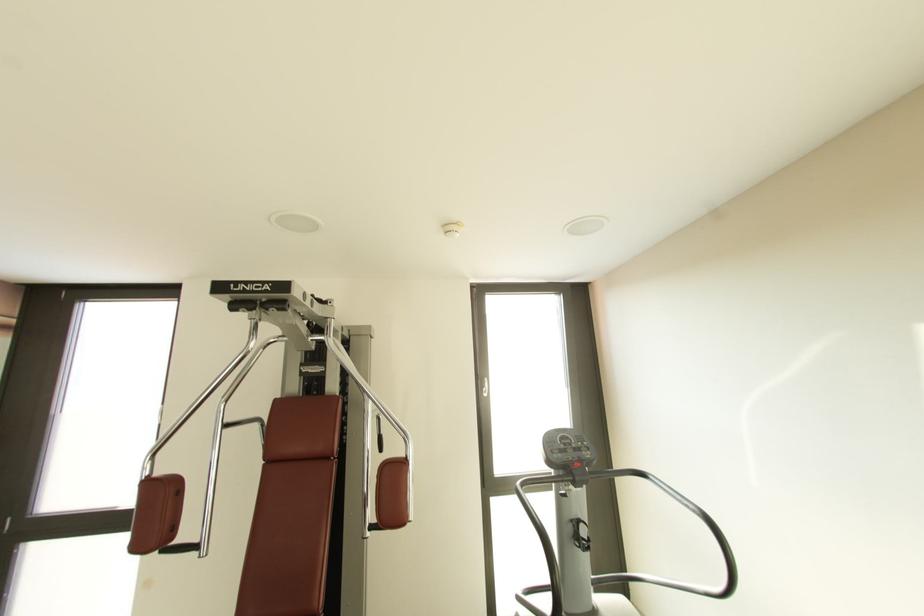
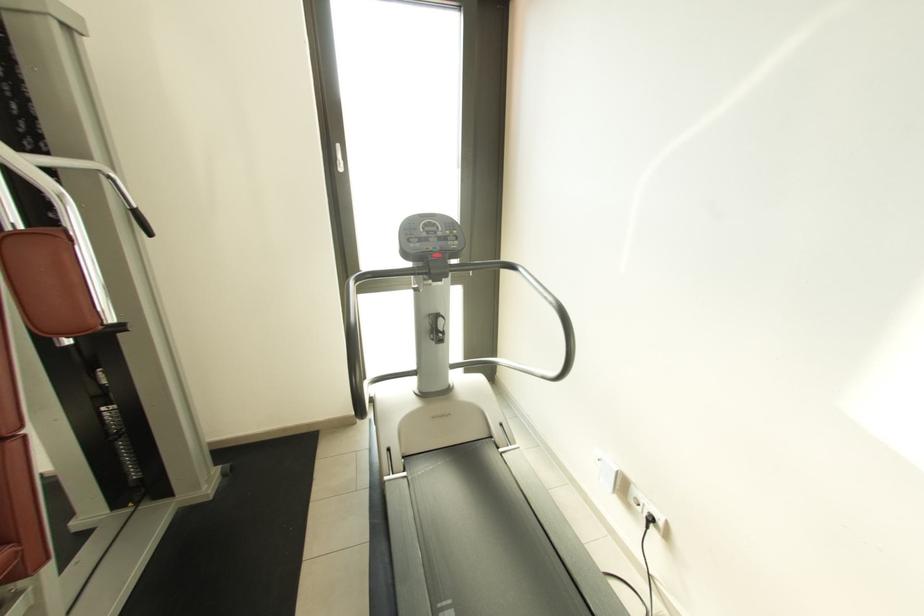
Locate, in the second image, the point that corresponds to point (573, 442) in the first image.

(439, 230)